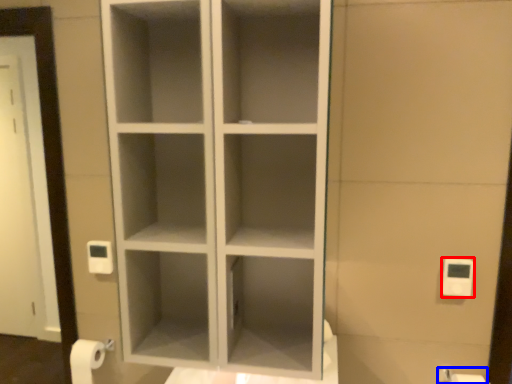
Question: Which object is further to the camera taking this photo, light switch (highlighted by a red box) or toilet paper (highlighted by a blue box)?

Choices:
 (A) light switch
 (B) toilet paper

Answer: (A)